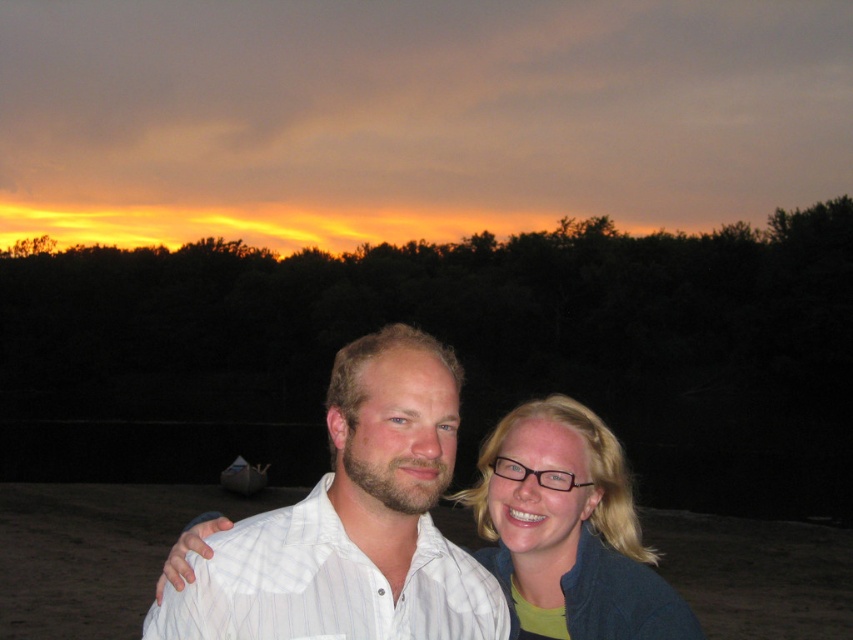
Question: Which object is farther from the camera taking this photo?

Choices:
 (A) blonde hair at center
 (B) white striped shirt at center

Answer: (A)

Question: Does white striped shirt at center appear under blonde hair at center?

Choices:
 (A) yes
 (B) no

Answer: (B)

Question: Does white striped shirt at center have a smaller size compared to blonde hair at center?

Choices:
 (A) yes
 (B) no

Answer: (A)

Question: Which point is closer to the camera taking this photo?

Choices:
 (A) (225, 552)
 (B) (675, 618)

Answer: (A)

Question: Which point appears closest to the camera in this image?

Choices:
 (A) (184, 598)
 (B) (601, 636)

Answer: (A)

Question: Does white striped shirt at center have a larger size compared to blonde hair at center?

Choices:
 (A) yes
 (B) no

Answer: (B)